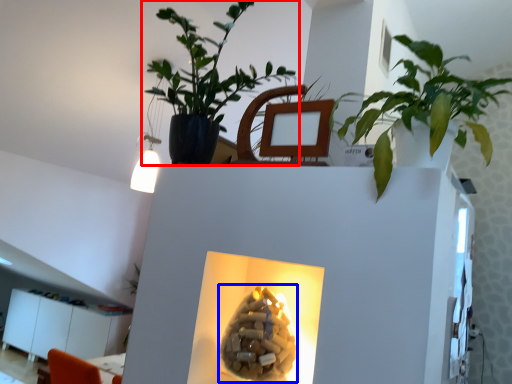
Question: Which object appears closest to the camera in this image, houseplant (highlighted by a red box) or flower (highlighted by a blue box)?

Choices:
 (A) houseplant
 (B) flower

Answer: (B)